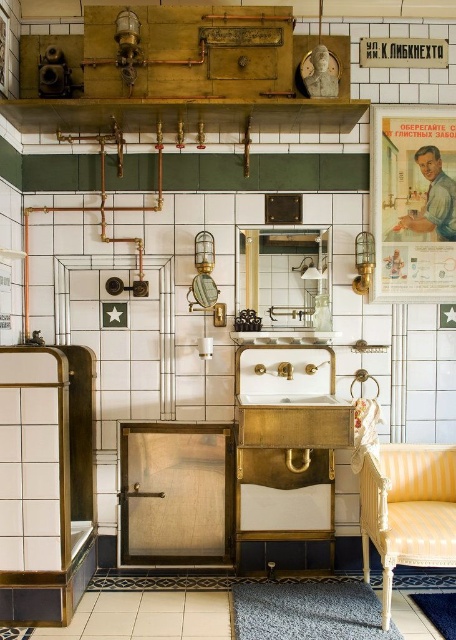
Can you confirm if matte paper poster at upper right is shorter than yellow striped chair at lower right?

Incorrect, matte paper poster at upper right's height does not fall short of yellow striped chair at lower right's.

Does matte paper poster at upper right appear on the left side of yellow striped chair at lower right?

Incorrect, matte paper poster at upper right is not on the left side of yellow striped chair at lower right.

The width and height of the screenshot is (456, 640). Find the location of `matte paper poster at upper right`. matte paper poster at upper right is located at coordinates (413, 202).